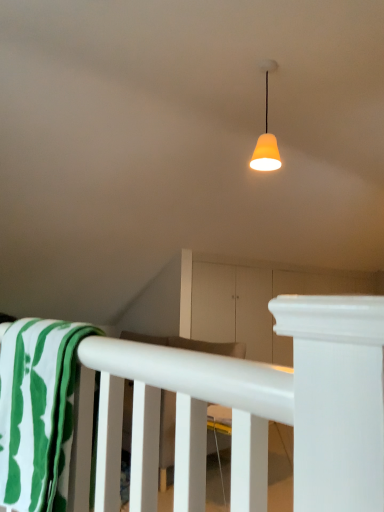
Question: Is white matte rail at lower center surrounding matte orange lampshade at upper center?

Choices:
 (A) no
 (B) yes

Answer: (A)

Question: From the image's perspective, is white matte rail at lower center on top of matte orange lampshade at upper center?

Choices:
 (A) no
 (B) yes

Answer: (A)

Question: Is the position of white matte rail at lower center more distant than that of matte orange lampshade at upper center?

Choices:
 (A) no
 (B) yes

Answer: (A)

Question: Is white matte rail at lower center positioned before matte orange lampshade at upper center?

Choices:
 (A) no
 (B) yes

Answer: (B)

Question: Is white matte rail at lower center facing towards matte orange lampshade at upper center?

Choices:
 (A) yes
 (B) no

Answer: (B)

Question: From a real-world perspective, is white matte rail at lower center over matte orange lampshade at upper center?

Choices:
 (A) no
 (B) yes

Answer: (A)

Question: Is matte orange lampshade at upper center aimed at white matte rail at lower center?

Choices:
 (A) yes
 (B) no

Answer: (B)

Question: Can you confirm if matte orange lampshade at upper center is bigger than white matte rail at lower center?

Choices:
 (A) no
 (B) yes

Answer: (A)

Question: Are matte orange lampshade at upper center and white matte rail at lower center making contact?

Choices:
 (A) no
 (B) yes

Answer: (A)

Question: From the image's perspective, is matte orange lampshade at upper center located beneath white matte rail at lower center?

Choices:
 (A) yes
 (B) no

Answer: (B)

Question: Does matte orange lampshade at upper center have a smaller size compared to white matte rail at lower center?

Choices:
 (A) yes
 (B) no

Answer: (A)

Question: From a real-world perspective, is matte orange lampshade at upper center located beneath white matte rail at lower center?

Choices:
 (A) no
 (B) yes

Answer: (A)

Question: Is white matte rail at lower center oriented towards green striped fabric at lower left?

Choices:
 (A) yes
 (B) no

Answer: (B)